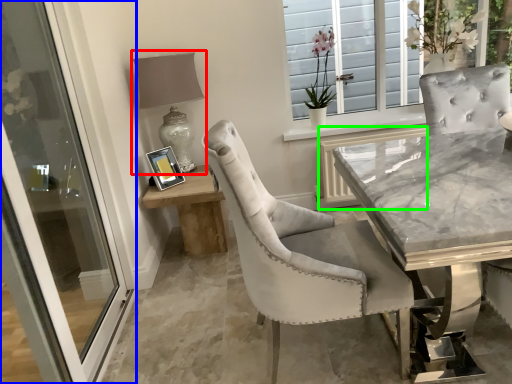
Question: Considering the real-world distances, which object is farthest from table lamp (highlighted by a red box)? door (highlighted by a blue box) or shutter (highlighted by a green box)?

Choices:
 (A) door
 (B) shutter

Answer: (B)